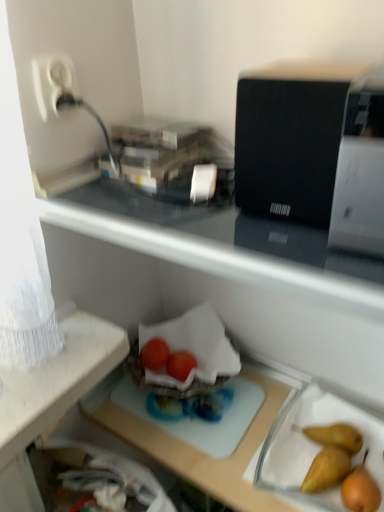
Question: Is white glossy printer at upper right, which appears as the first appliance when viewed from the right, positioned in front of glossy plastic tomatoes at center, positioned as the 2th green vegetables in left-to-right order?

Choices:
 (A) yes
 (B) no

Answer: (A)

Question: Can you confirm if white glossy printer at upper right, which appears as the first appliance when viewed from the right, is bigger than glossy plastic tomatoes at center, positioned as the 2th green vegetables in left-to-right order?

Choices:
 (A) no
 (B) yes

Answer: (B)

Question: Considering the relative sizes of white glossy printer at upper right, which appears as the first appliance when viewed from the right, and glossy plastic tomatoes at center, positioned as the 2th green vegetables in left-to-right order, in the image provided, is white glossy printer at upper right, which appears as the first appliance when viewed from the right, taller than glossy plastic tomatoes at center, positioned as the 2th green vegetables in left-to-right order,?

Choices:
 (A) yes
 (B) no

Answer: (A)

Question: Is white glossy printer at upper right, which appears as the first appliance when viewed from the right, further to the viewer compared to glossy plastic tomatoes at center, which is the first green vegetables in right-to-left order?

Choices:
 (A) yes
 (B) no

Answer: (B)

Question: From a real-world perspective, is white glossy printer at upper right, arranged as the second appliance when viewed from the left, under glossy plastic tomatoes at center, positioned as the 2th green vegetables in left-to-right order?

Choices:
 (A) yes
 (B) no

Answer: (B)

Question: Is white plastic plug at upper left taller or shorter than glossy plastic tomatoes at center, which is the first green vegetables in right-to-left order?

Choices:
 (A) short
 (B) tall

Answer: (B)

Question: Considering the relative positions of white plastic plug at upper left and glossy plastic tomatoes at center, which is the first green vegetables in right-to-left order, in the image provided, is white plastic plug at upper left to the left or to the right of glossy plastic tomatoes at center, which is the first green vegetables in right-to-left order,?

Choices:
 (A) right
 (B) left

Answer: (B)

Question: Considering the positions of white plastic plug at upper left and glossy plastic tomatoes at center, which is the first green vegetables in right-to-left order, in the image, is white plastic plug at upper left bigger or smaller than glossy plastic tomatoes at center, which is the first green vegetables in right-to-left order,?

Choices:
 (A) big
 (B) small

Answer: (A)

Question: Is white plastic plug at upper left inside or outside of glossy plastic tomatoes at center, which is the first green vegetables in right-to-left order?

Choices:
 (A) inside
 (B) outside

Answer: (B)

Question: Do you think white plastic plug at upper left is within glossy plastic tomatoes at center, the first green vegetables when ordered from left to right, or outside of it?

Choices:
 (A) inside
 (B) outside

Answer: (B)

Question: Is white plastic plug at upper left wider or thinner than glossy plastic tomatoes at center, the second green vegetables viewed from the right?

Choices:
 (A) thin
 (B) wide

Answer: (A)

Question: Is point (39, 79) closer or farther from the camera than point (157, 342)?

Choices:
 (A) farther
 (B) closer

Answer: (B)

Question: Relative to glossy plastic tomatoes at center, the second green vegetables viewed from the right, is white plastic plug at upper left in front or behind?

Choices:
 (A) behind
 (B) front

Answer: (B)

Question: Considering the positions of point (372, 223) and point (145, 344), is point (372, 223) closer or farther from the camera than point (145, 344)?

Choices:
 (A) closer
 (B) farther

Answer: (A)

Question: Relative to glossy plastic tomatoes at center, the second green vegetables viewed from the right, is white glossy printer at upper right, which appears as the first appliance when viewed from the right, in front or behind?

Choices:
 (A) front
 (B) behind

Answer: (A)